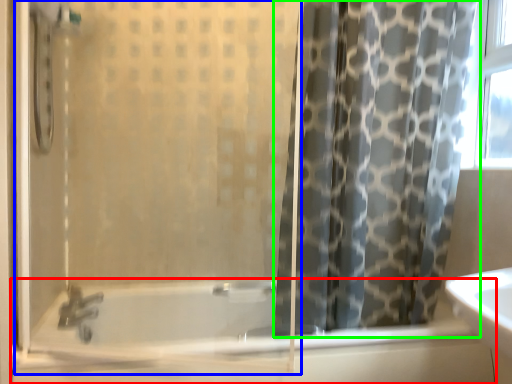
Question: Which object is positioned closest to bathtub (highlighted by a red box)? Select from screen door (highlighted by a blue box) and curtain (highlighted by a green box).

Choices:
 (A) screen door
 (B) curtain

Answer: (A)